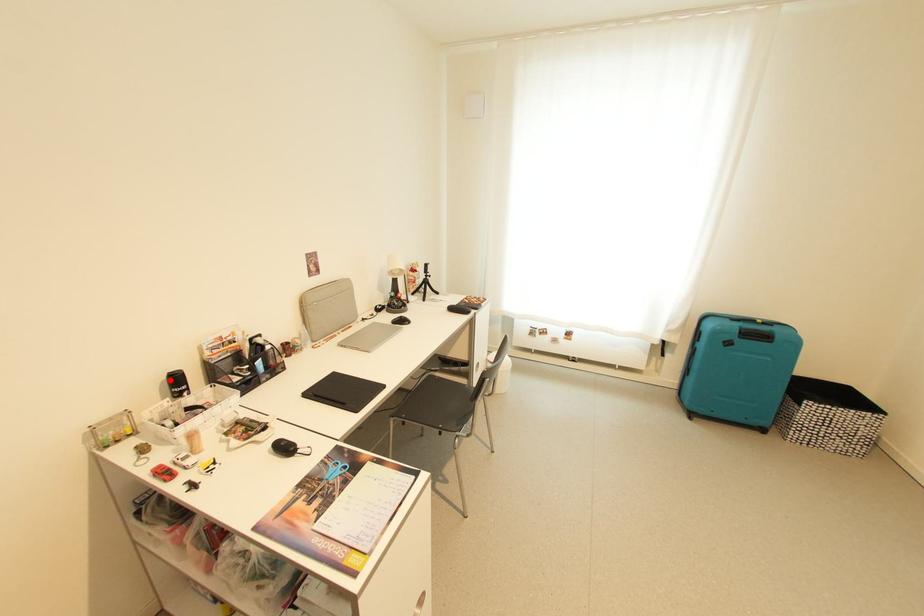
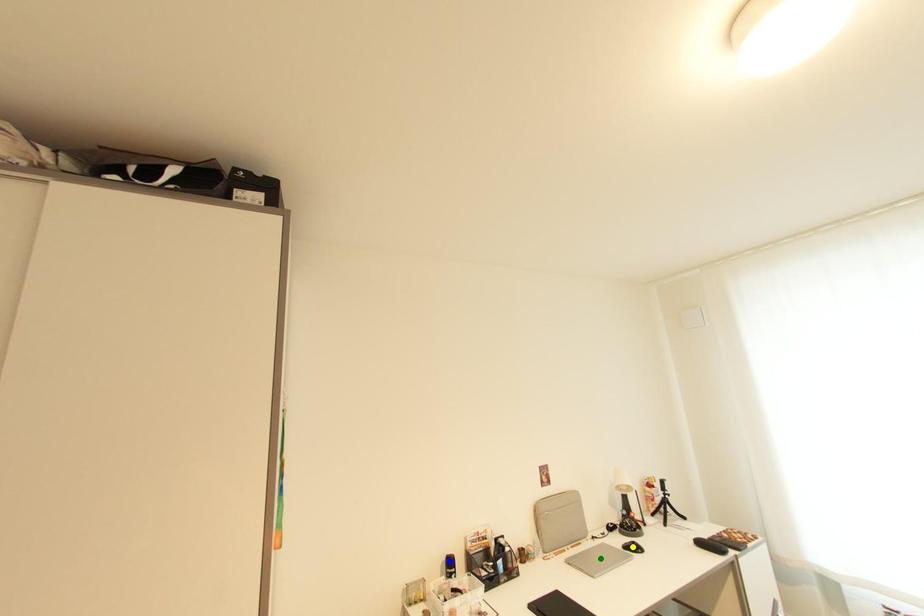
Question: I am providing you with two images of the same scene from different viewpoints. A red point is marked on the first image. You are given multiple points on the second image. Which point in image 2 is actually the same real-world point as the red point in image 1?

Choices:
 (A) yellow point
 (B) blue point
 (C) green point

Answer: (B)